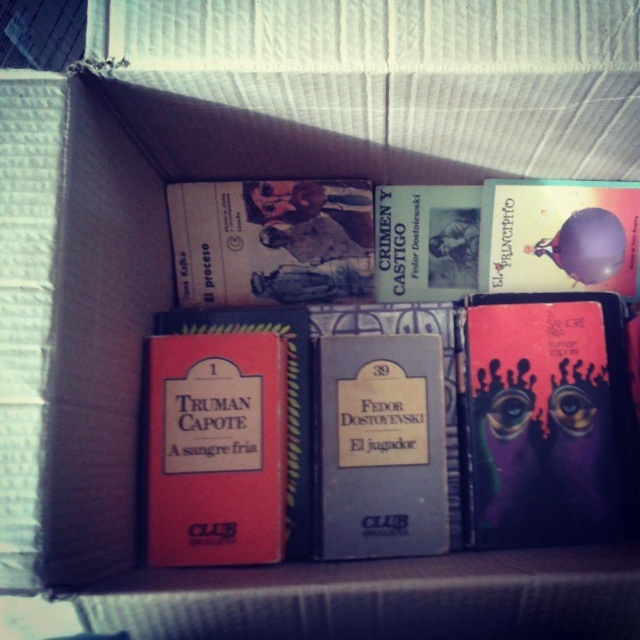
Question: Where is purple matte book at right located in relation to blue hardcover book at center in the image?

Choices:
 (A) above
 (B) below

Answer: (A)

Question: Which point is closer to the camera taking this photo?

Choices:
 (A) (332, 387)
 (B) (611, 248)
 (C) (506, 348)
 (D) (448, 266)

Answer: (A)

Question: Which point is closer to the camera taking this photo?

Choices:
 (A) (452, 289)
 (B) (416, 420)
 (C) (237, 556)

Answer: (C)

Question: Is purple matte book at right bigger than shiny metallic book at upper right?

Choices:
 (A) yes
 (B) no

Answer: (A)

Question: Is purple matte book at right positioned at the back of shiny metallic book at upper right?

Choices:
 (A) no
 (B) yes

Answer: (A)

Question: Which point appears closest to the camera in this image?

Choices:
 (A) (346, 348)
 (B) (435, 193)
 (C) (163, 465)

Answer: (C)